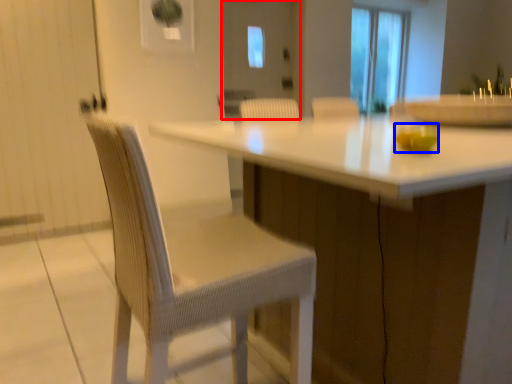
Question: Which point is closer to the camera, screen door (highlighted by a red box) or food (highlighted by a blue box)?

Choices:
 (A) screen door
 (B) food

Answer: (B)